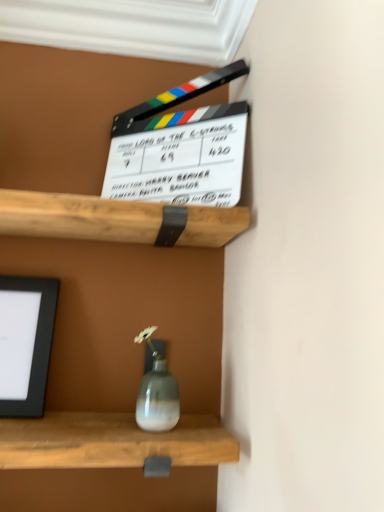
The image size is (384, 512). In order to click on white smooth window frame at upper center in this screenshot , I will do `click(132, 27)`.

The height and width of the screenshot is (512, 384). Describe the element at coordinates (132, 27) in the screenshot. I see `white smooth window frame at upper center` at that location.

Where is `matte black picture frame at left`? matte black picture frame at left is located at coordinates coord(25,343).

Describe the element at coordinates (25, 343) in the screenshot. I see `matte black picture frame at left` at that location.

Measure the distance between matte black picture frame at left and camera.

matte black picture frame at left is 30.41 inches away from camera.

Where is `white smooth window frame at upper center`? white smooth window frame at upper center is located at coordinates (132, 27).

Is white smooth window frame at upper center to the right of matte black picture frame at left from the viewer's perspective?

Indeed, white smooth window frame at upper center is positioned on the right side of matte black picture frame at left.

Which object is more forward, white smooth window frame at upper center or matte black picture frame at left?

white smooth window frame at upper center is more forward.

Is point (133, 17) behind point (18, 361)?

That is True.

From the image's perspective, which one is positioned higher, white smooth window frame at upper center or matte black picture frame at left?

white smooth window frame at upper center.

From a real-world perspective, between white smooth window frame at upper center and matte black picture frame at left, who is vertically lower?

matte black picture frame at left, from a real-world perspective.

Does white smooth window frame at upper center have a greater width compared to matte black picture frame at left?

Yes.

Based on the photo, which of these two, white smooth window frame at upper center or matte black picture frame at left, stands taller?

Standing taller between the two is matte black picture frame at left.

Can you confirm if white smooth window frame at upper center is smaller than matte black picture frame at left?

Incorrect, white smooth window frame at upper center is not smaller in size than matte black picture frame at left.

In the scene shown: Is white smooth window frame at upper center outside of matte black picture frame at left?

Yes, white smooth window frame at upper center is located beyond the bounds of matte black picture frame at left.

Is white smooth window frame at upper center not close to matte black picture frame at left?

They are positioned close to each other.

Is white smooth window frame at upper center positioned with its back to matte black picture frame at left?

white smooth window frame at upper center is not turned away from matte black picture frame at left.

How different are the orientations of white smooth window frame at upper center and matte black picture frame at left in degrees?

2.8 degrees.

At what (x,y) coordinates should I click in order to perform the action: click on picture frame beneath the white smooth window frame at upper center (from a real-world perspective). Please return your answer as a coordinate pair (x, y). Looking at the image, I should click on (25, 343).

Is matte black picture frame at left to the left or to the right of white smooth window frame at upper center in the image?

From the image, it's evident that matte black picture frame at left is to the left of white smooth window frame at upper center.

Considering their positions, is matte black picture frame at left located in front of or behind white smooth window frame at upper center?

matte black picture frame at left is behind white smooth window frame at upper center.

In the scene shown: Which is nearer, [4,279] or [53,22]?

The point [4,279] is closer.

From the image's perspective, does matte black picture frame at left appear lower than white smooth window frame at upper center?

Yes, from the image's perspective, matte black picture frame at left is below white smooth window frame at upper center.

From a real-world perspective, which object stands above the other?

white smooth window frame at upper center is physically above.

Which object is thinner, matte black picture frame at left or white smooth window frame at upper center?

matte black picture frame at left.

Who is taller, matte black picture frame at left or white smooth window frame at upper center?

matte black picture frame at left.

Does matte black picture frame at left have a smaller size compared to white smooth window frame at upper center?

Yes, matte black picture frame at left is smaller than white smooth window frame at upper center.

Is matte black picture frame at left spatially inside white smooth window frame at upper center, or outside of it?

matte black picture frame at left is not inside white smooth window frame at upper center, it's outside.

Is matte black picture frame at left in contact with white smooth window frame at upper center?

No, matte black picture frame at left is not with white smooth window frame at upper center.

Based on the photo, could you tell me if matte black picture frame at left is turned towards white smooth window frame at upper center?

No, matte black picture frame at left is not turned towards white smooth window frame at upper center.

How many degrees apart are the facing directions of matte black picture frame at left and white smooth window frame at upper center?

The angular difference between matte black picture frame at left and white smooth window frame at upper center is 2.8 degrees.

In order to click on window frame positioned vertically above the matte black picture frame at left (from a real-world perspective) in this screenshot , I will do [132, 27].

This screenshot has height=512, width=384. What are the coordinates of `window frame in front of the matte black picture frame at left` in the screenshot? It's located at (132, 27).

Find the location of a particular element. window frame above the matte black picture frame at left (from the image's perspective) is located at coordinates (132, 27).